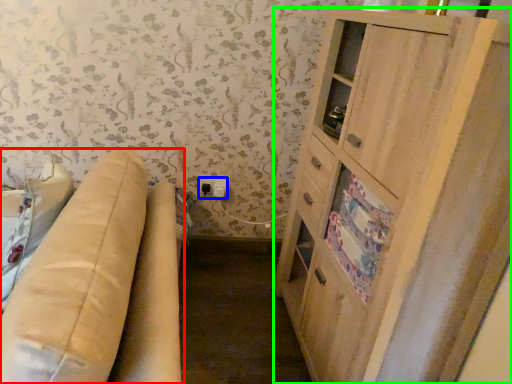
Question: Based on their relative distances, which object is farther from studio couch (highlighted by a red box)? Choose from electric outlet (highlighted by a blue box) and cabinetry (highlighted by a green box).

Choices:
 (A) electric outlet
 (B) cabinetry

Answer: (A)